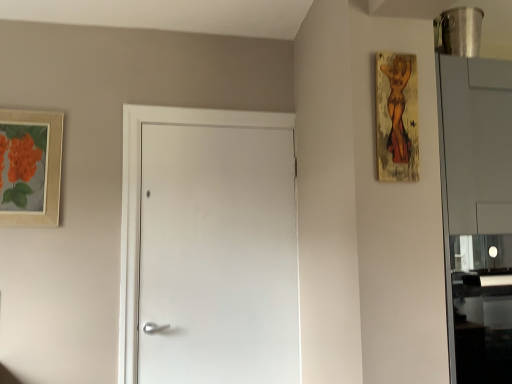
Image resolution: width=512 pixels, height=384 pixels. What do you see at coordinates (208, 247) in the screenshot?
I see `white matte door at center` at bounding box center [208, 247].

At what (x,y) coordinates should I click in order to perform the action: click on white matte door at center. Please return your answer as a coordinate pair (x, y). Image resolution: width=512 pixels, height=384 pixels. Looking at the image, I should click on (208, 247).

From the image's perspective, which is above, white matte door at center or matte wooden picture frame at upper left, the second picture frame when ordered from front to back?

matte wooden picture frame at upper left, the second picture frame when ordered from front to back, from the image's perspective.

Between white matte door at center and matte wooden picture frame at upper left, acting as the second picture frame starting from the right, which one has larger size?

With larger size is white matte door at center.

Choose the correct answer: Is white matte door at center inside matte wooden picture frame at upper left, the second picture frame when ordered from front to back, or outside it?

white matte door at center cannot be found inside matte wooden picture frame at upper left, the second picture frame when ordered from front to back.

How different are the orientations of white matte door at center and matte wooden picture frame at upper left, the second picture frame when ordered from front to back, in degrees?

0.433 degrees.

In terms of height, does white matte door at center look taller or shorter compared to wooden textured painting at upper right, marked as the 2th picture frame in a back-to-front arrangement?

Clearly, white matte door at center is taller compared to wooden textured painting at upper right, marked as the 2th picture frame in a back-to-front arrangement.

Is point (138, 323) closer or farther from the camera than point (390, 147)?

Clearly, point (138, 323) is more distant from the camera than point (390, 147).

Which of these two, white matte door at center or wooden textured painting at upper right, marked as the 2th picture frame in a back-to-front arrangement, is thinner?

Thinner between the two is wooden textured painting at upper right, marked as the 2th picture frame in a back-to-front arrangement.

Is wooden textured painting at upper right, marked as the 2th picture frame in a back-to-front arrangement, surrounded by white matte door at center?

No, wooden textured painting at upper right, marked as the 2th picture frame in a back-to-front arrangement, is not inside white matte door at center.

How far apart are wooden textured painting at upper right, marked as the 2th picture frame in a back-to-front arrangement, and matte wooden picture frame at upper left, the first picture frame positioned from the back?

wooden textured painting at upper right, marked as the 2th picture frame in a back-to-front arrangement, and matte wooden picture frame at upper left, the first picture frame positioned from the back, are 1.51 meters apart.

From the image's perspective, is wooden textured painting at upper right, marked as the first picture frame in a right-to-left arrangement, positioned above or below matte wooden picture frame at upper left, acting as the second picture frame starting from the right?

Based on their image positions, wooden textured painting at upper right, marked as the first picture frame in a right-to-left arrangement, is located above matte wooden picture frame at upper left, acting as the second picture frame starting from the right.

Is wooden textured painting at upper right, marked as the 2th picture frame in a back-to-front arrangement, oriented towards matte wooden picture frame at upper left, the first picture frame positioned from the back?

No, wooden textured painting at upper right, marked as the 2th picture frame in a back-to-front arrangement, does not turn towards matte wooden picture frame at upper left, the first picture frame positioned from the back.

Can you confirm if wooden textured painting at upper right, marked as the 2th picture frame in a back-to-front arrangement, is positioned to the left of matte wooden picture frame at upper left, which is the first picture frame from left to right?

In fact, wooden textured painting at upper right, marked as the 2th picture frame in a back-to-front arrangement, is to the right of matte wooden picture frame at upper left, which is the first picture frame from left to right.

Does wooden textured painting at upper right, the 2th picture frame viewed from the left, come behind white matte door at center?

No, wooden textured painting at upper right, the 2th picture frame viewed from the left, is closer to the camera.

Where is `door behind the wooden textured painting at upper right, marked as the 2th picture frame in a back-to-front arrangement`? This screenshot has height=384, width=512. door behind the wooden textured painting at upper right, marked as the 2th picture frame in a back-to-front arrangement is located at coordinates (208, 247).

Can you tell me how much wooden textured painting at upper right, marked as the 2th picture frame in a back-to-front arrangement, and white matte door at center differ in facing direction?

3.24 degrees separate the facing orientations of wooden textured painting at upper right, marked as the 2th picture frame in a back-to-front arrangement, and white matte door at center.

Between wooden textured painting at upper right, which is counted as the first picture frame, starting from the front, and white matte door at center, which one appears on the right side from the viewer's perspective?

wooden textured painting at upper right, which is counted as the first picture frame, starting from the front, is more to the right.

From the image's perspective, which is above, matte wooden picture frame at upper left, the first picture frame positioned from the back, or wooden textured painting at upper right, marked as the first picture frame in a right-to-left arrangement?

From the image's view, wooden textured painting at upper right, marked as the first picture frame in a right-to-left arrangement, is above.

Is point (44, 116) positioned after point (399, 130)?

Yes, point (44, 116) is behind point (399, 130).

Could you tell me if matte wooden picture frame at upper left, acting as the second picture frame starting from the right, is facing wooden textured painting at upper right, which is counted as the first picture frame, starting from the front?

No, matte wooden picture frame at upper left, acting as the second picture frame starting from the right, does not turn towards wooden textured painting at upper right, which is counted as the first picture frame, starting from the front.

From the picture: Is matte wooden picture frame at upper left, the second picture frame when ordered from front to back, wider or thinner than wooden textured painting at upper right, marked as the first picture frame in a right-to-left arrangement?

In the image, matte wooden picture frame at upper left, the second picture frame when ordered from front to back, appears to be more narrow than wooden textured painting at upper right, marked as the first picture frame in a right-to-left arrangement.

Does point (30, 148) appear closer or farther from the camera than point (234, 182)?

Point (30, 148) is positioned closer to the camera compared to point (234, 182).

Based on the photo, from the image's perspective, is matte wooden picture frame at upper left, the first picture frame positioned from the back, on white matte door at center?

Indeed, from the image's perspective, matte wooden picture frame at upper left, the first picture frame positioned from the back, is shown above white matte door at center.

Choose the correct answer: Is matte wooden picture frame at upper left, acting as the second picture frame starting from the right, inside white matte door at center or outside it?

matte wooden picture frame at upper left, acting as the second picture frame starting from the right, cannot be found inside white matte door at center.

Can you tell me how much matte wooden picture frame at upper left, the second picture frame when ordered from front to back, and white matte door at center differ in facing direction?

0.433 degrees.

Find the location of a particular element. the 1st picture frame positioned above the white matte door at center (from a real-world perspective) is located at coordinates (30, 167).

From the white matte door at center, count 2nd picture frames forward and point to it. Please provide its 2D coordinates.

[(396, 117)]

Estimate the real-world distances between objects in this image. Which object is further from wooden textured painting at upper right, the 2th picture frame viewed from the left, white matte door at center or matte wooden picture frame at upper left, the first picture frame positioned from the back?

matte wooden picture frame at upper left, the first picture frame positioned from the back, lies further to wooden textured painting at upper right, the 2th picture frame viewed from the left, than the other object.

When comparing their distances from white matte door at center, does matte wooden picture frame at upper left, the second picture frame when ordered from front to back, or wooden textured painting at upper right, marked as the 2th picture frame in a back-to-front arrangement, seem further?

Based on the image, wooden textured painting at upper right, marked as the 2th picture frame in a back-to-front arrangement, appears to be further to white matte door at center.

Based on their spatial positions, is white matte door at center or wooden textured painting at upper right, which is counted as the first picture frame, starting from the front, further from matte wooden picture frame at upper left, the second picture frame when ordered from front to back?

wooden textured painting at upper right, which is counted as the first picture frame, starting from the front, lies further to matte wooden picture frame at upper left, the second picture frame when ordered from front to back, than the other object.

Which object lies nearer to the anchor point matte wooden picture frame at upper left, the first picture frame positioned from the back, wooden textured painting at upper right, marked as the 2th picture frame in a back-to-front arrangement, or white matte door at center?

Based on the image, white matte door at center appears to be nearer to matte wooden picture frame at upper left, the first picture frame positioned from the back.

From the image, which object appears to be farther from white matte door at center, wooden textured painting at upper right, marked as the 2th picture frame in a back-to-front arrangement, or matte wooden picture frame at upper left, which is the first picture frame from left to right?

wooden textured painting at upper right, marked as the 2th picture frame in a back-to-front arrangement.

When comparing their distances from wooden textured painting at upper right, marked as the 2th picture frame in a back-to-front arrangement, does matte wooden picture frame at upper left, the first picture frame positioned from the back, or white matte door at center seem further?

Among the two, matte wooden picture frame at upper left, the first picture frame positioned from the back, is located further to wooden textured painting at upper right, marked as the 2th picture frame in a back-to-front arrangement.

Where is `door situated between matte wooden picture frame at upper left, acting as the second picture frame starting from the right, and wooden textured painting at upper right, the 2th picture frame viewed from the left, from left to right`? The width and height of the screenshot is (512, 384). door situated between matte wooden picture frame at upper left, acting as the second picture frame starting from the right, and wooden textured painting at upper right, the 2th picture frame viewed from the left, from left to right is located at coordinates (208, 247).